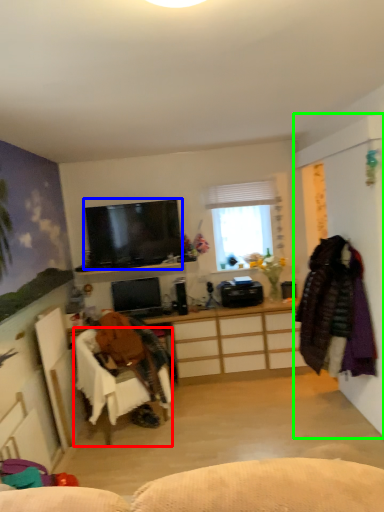
Question: Which is nearer to the chair (highlighted by a red box)? television (highlighted by a blue box) or side (highlighted by a green box).

Choices:
 (A) television
 (B) side

Answer: (A)